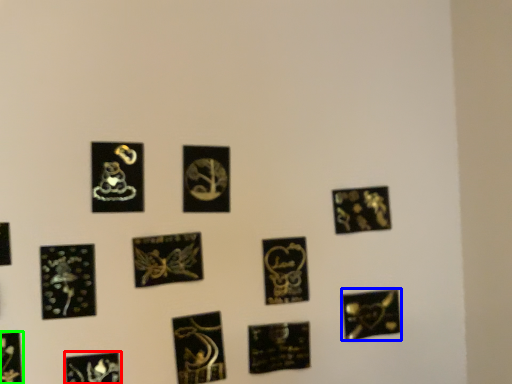
Question: Which object is the farthest from picture frame (highlighted by a red box)? Choose among these: picture frame (highlighted by a blue box) or picture frame (highlighted by a green box).

Choices:
 (A) picture frame
 (B) picture frame

Answer: (A)